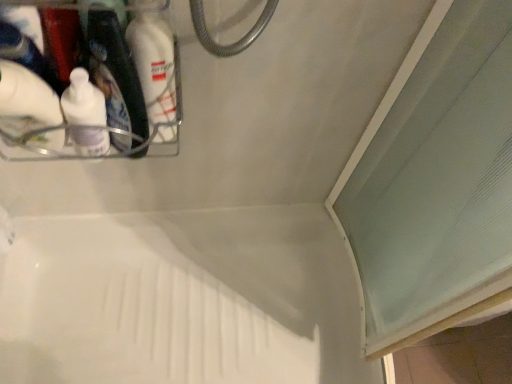
Image resolution: width=512 pixels, height=384 pixels. Describe the element at coordinates (135, 310) in the screenshot. I see `white plastic bath at center` at that location.

The image size is (512, 384). In order to click on white matte bottle at upper left in this screenshot , I will do `click(153, 59)`.

Between white plastic bath at center and white matte bottle at upper left, which one has larger size?

white plastic bath at center is bigger.

Looking at this image, is white plastic bath at center touching white matte bottle at upper left?

They are not placed beside each other.

From a real-world perspective, which object stands above the other?

white matte bottle at upper left is physically above.

Which is more to the right, white plastic bath at center or white matte bottle at upper left?

white matte bottle at upper left.

Is the surface of white matte bottle at upper left in direct contact with white matte bottle at upper left?

No, white matte bottle at upper left is not beside white matte bottle at upper left.

Is point (15, 80) behind point (163, 28)?

No, it is not.

Is white matte bottle at upper left taller or shorter than white matte bottle at upper left?

Considering their sizes, white matte bottle at upper left has less height than white matte bottle at upper left.

From a real-world perspective, which is physically below, white plastic bath at center or white matte bottle at upper left?

In real-world perspective, white plastic bath at center is lower.

Is white plastic bath at center smaller than white matte bottle at upper left?

No, white plastic bath at center is not smaller than white matte bottle at upper left.

Between white plastic bath at center and white matte bottle at upper left, which one has more height?

white plastic bath at center is taller.

Is white matte bottle at upper left not within white plastic bath at center?

That's correct, white matte bottle at upper left is outside of white plastic bath at center.

From the image's perspective, is white matte bottle at upper left located above or below white plastic bath at center?

From the image's perspective, white matte bottle at upper left appears above white plastic bath at center.

Based on their positions, is white matte bottle at upper left located to the left or right of white plastic bath at center?

Clearly, white matte bottle at upper left is on the right of white plastic bath at center in the image.

Can you confirm if white matte bottle at upper left is shorter than white plastic bath at center?

Correct, white matte bottle at upper left is not as tall as white plastic bath at center.

Is the surface of white matte bottle at upper left in direct contact with white plastic bath at center?

They are not placed beside each other.

Which of these two, white matte bottle at upper left or white plastic bath at center, is wider?

With larger width is white plastic bath at center.

In terms of height, does white matte bottle at upper left look taller or shorter compared to white plastic bath at center?

Clearly, white matte bottle at upper left is shorter compared to white plastic bath at center.

From the image's perspective, would you say white matte bottle at upper left is positioned over white matte bottle at upper left?

Yes, from the image's perspective, white matte bottle at upper left is on top of white matte bottle at upper left.

Consider the image. Is white matte bottle at upper left facing towards white matte bottle at upper left?

No.

Which is more to the left, white matte bottle at upper left or white matte bottle at upper left?

From the viewer's perspective, white matte bottle at upper left appears more on the left side.

The image size is (512, 384). I want to click on bath located below the white matte bottle at upper left (from the image's perspective), so click(135, 310).

Where is `bottle located above the white matte bottle at upper left (from a real-world perspective)`? The width and height of the screenshot is (512, 384). bottle located above the white matte bottle at upper left (from a real-world perspective) is located at coordinates (153, 59).

In the scene shown: When comparing their distances from white matte bottle at upper left, does white plastic bath at center or white matte bottle at upper left seem further?

white plastic bath at center lies further to white matte bottle at upper left than the other object.

Considering their positions, is white plastic bath at center positioned further to white matte bottle at upper left than white matte bottle at upper left?

white plastic bath at center lies further to white matte bottle at upper left than the other object.

Which object lies further to the anchor point white plastic bath at center, white matte bottle at upper left or white matte bottle at upper left?

white matte bottle at upper left lies further to white plastic bath at center than the other object.

Based on their spatial positions, is white matte bottle at upper left or white plastic bath at center closer to white matte bottle at upper left?

Among the two, white matte bottle at upper left is located nearer to white matte bottle at upper left.

When comparing their distances from white plastic bath at center, does white matte bottle at upper left or white matte bottle at upper left seem further?

white matte bottle at upper left is positioned further to the anchor white plastic bath at center.

Considering their positions, is white matte bottle at upper left positioned closer to white matte bottle at upper left than white plastic bath at center?

Among the two, white matte bottle at upper left is located nearer to white matte bottle at upper left.

What are the coordinates of `cleaning product between white matte bottle at upper left and white plastic bath at center in the up-down direction` in the screenshot? It's located at (26, 101).